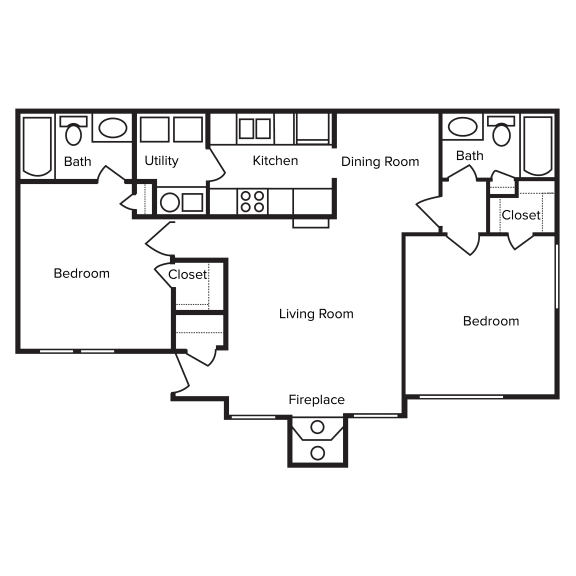
This screenshot has width=576, height=576. What are the coordinates of `fireplace` in the screenshot? It's located at (314, 425).